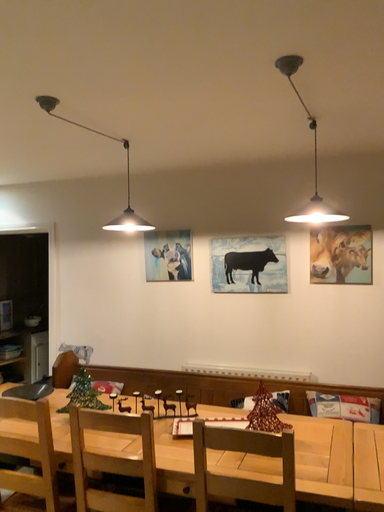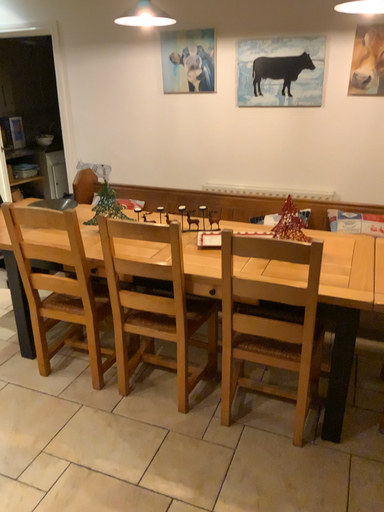
Question: How did the camera likely rotate when shooting the video?

Choices:
 (A) rotated downward
 (B) rotated upward

Answer: (A)